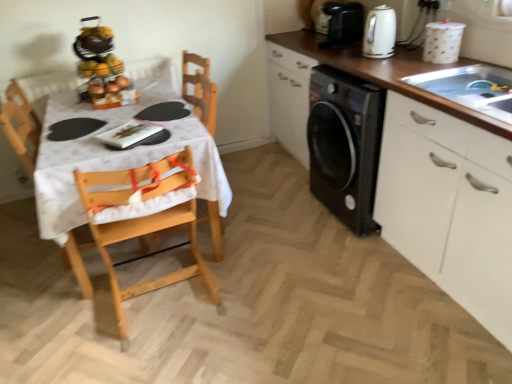
This screenshot has width=512, height=384. What are the coordinates of `vacant area that lies in front of white fabric tablecloth at left` in the screenshot? It's located at (141, 333).